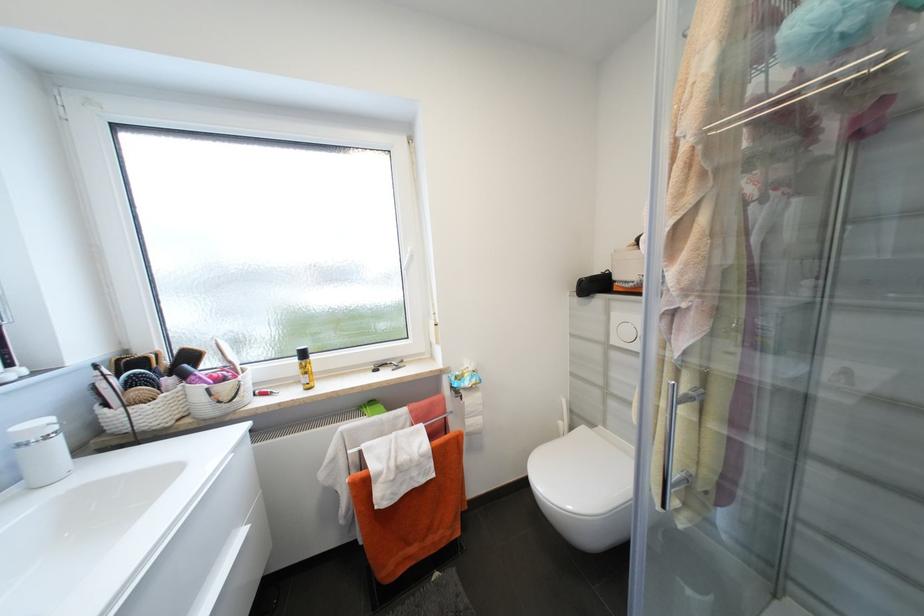
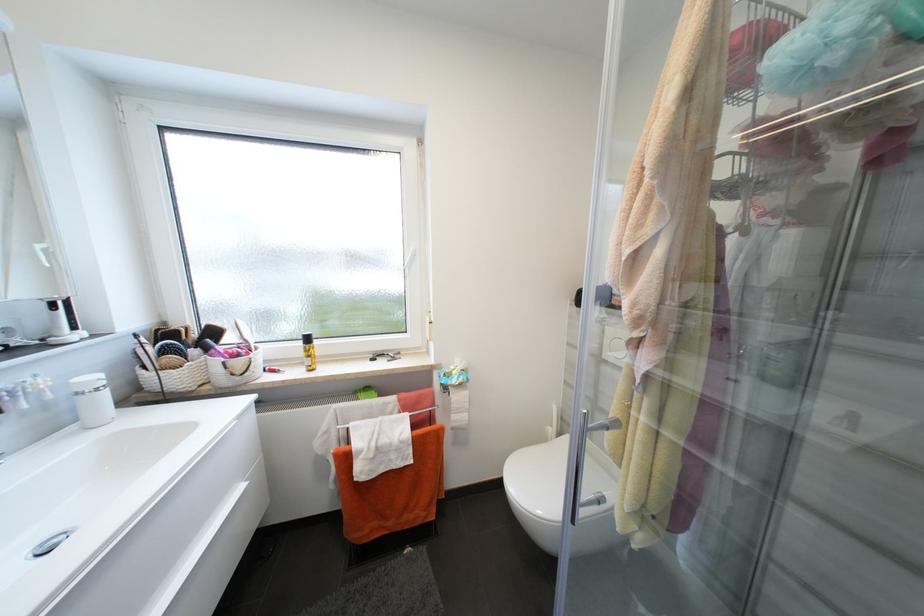
Question: What movement of the cameraman would produce the second image?

Choices:
 (A) Left
 (B) Right
 (C) Forward
 (D) Backward

Answer: (B)